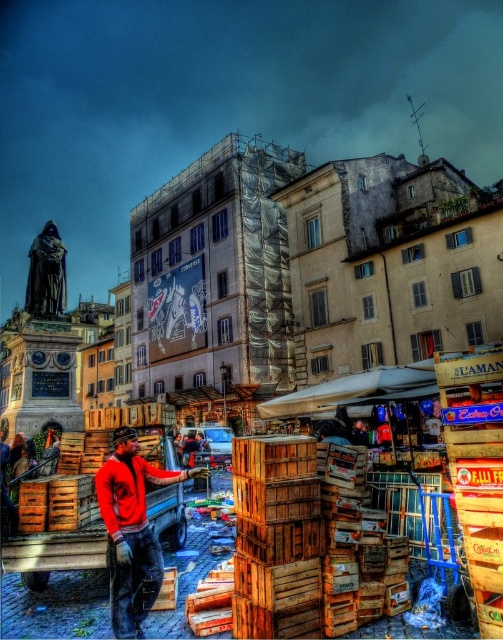
Can you confirm if red sweater at center is positioned below wooden crates at lower left?

No, red sweater at center is not below wooden crates at lower left.

Identify the location of red sweater at center. This screenshot has width=503, height=640. (131, 531).

Is wooden crates at center below wooden crates at lower left?

Incorrect, wooden crates at center is not positioned below wooden crates at lower left.

Who is more distant from viewer, (293, 595) or (79, 536)?

The point (79, 536) is behind.

Where is `wooden crates at center`? wooden crates at center is located at coordinates (277, 548).

Can you confirm if wooden crates at lower left is shorter than smooth dark statue at upper left?

Yes, wooden crates at lower left is shorter than smooth dark statue at upper left.

Can you confirm if wooden crates at lower left is wider than smooth dark statue at upper left?

Yes.

Who is more distant from viewer, (158, 532) or (56, 280)?

The point (56, 280) is more distant.

Find the location of a particular element. wooden crates at lower left is located at coordinates (54, 552).